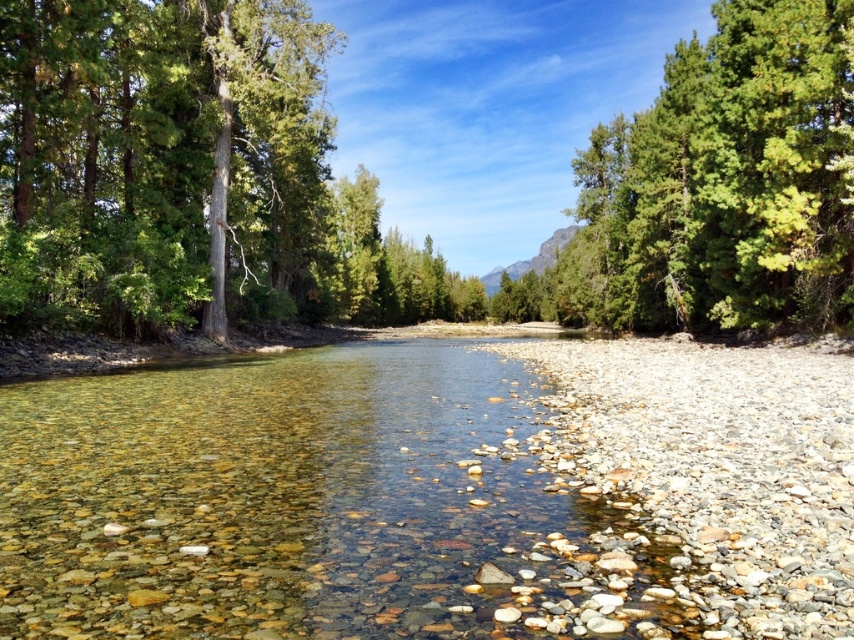
Can you confirm if green leafy forest at center is wider than green leafy tree at upper right?

Yes, green leafy forest at center is wider than green leafy tree at upper right.

Is green leafy forest at center taller than green leafy tree at upper right?

Yes.

Who is more forward, [297,86] or [677,161]?

Point [297,86] is more forward.

Identify the location of green leafy forest at center. (718, 188).

In the scene shown: Can you confirm if green leafy forest at center is smaller than clear pebbled water at center?

Actually, green leafy forest at center might be larger than clear pebbled water at center.

Who is more distant from viewer, (x=364, y=294) or (x=63, y=406)?

The point (x=364, y=294) is more distant.

Between point (828, 170) and point (342, 520), which one is positioned in front?

Positioned in front is point (342, 520).

You are a GUI agent. You are given a task and a screenshot of the screen. Output one action in this format:
    pyautogui.click(x=<x>, y=<y>)
    Task: Click on the green leafy forest at center
    Image resolution: width=854 pixels, height=640 pixels.
    Given the screenshot: What is the action you would take?
    pyautogui.click(x=718, y=188)

Does point (136, 572) come behind point (808, 170)?

That is False.

Find the location of a particular element. The width and height of the screenshot is (854, 640). clear pebbled water at center is located at coordinates pyautogui.click(x=300, y=502).

Does point (434, 493) come closer to viewer compared to point (648, 154)?

Yes.

The image size is (854, 640). In order to click on clear pebbled water at center in this screenshot , I will do `click(300, 502)`.